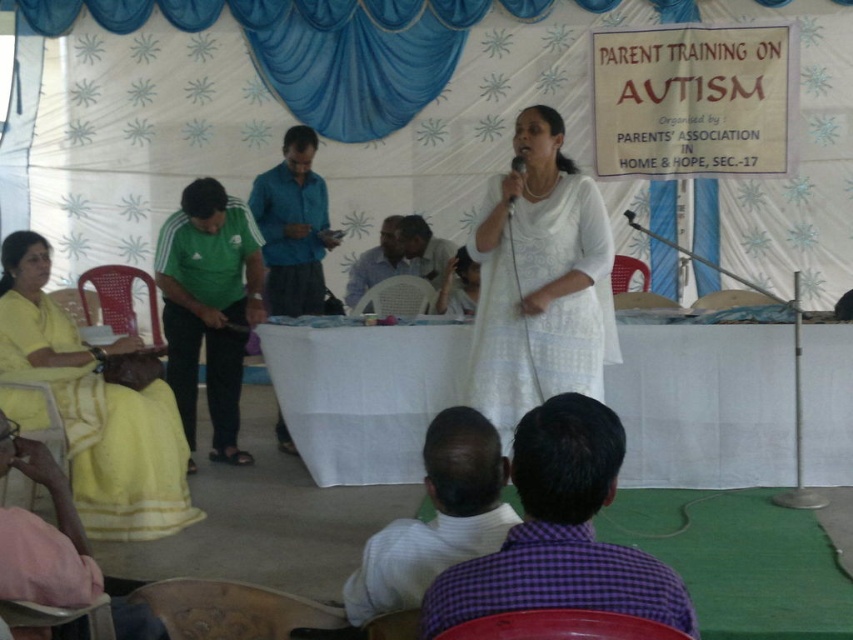
Is green adidas tracksuit at left smaller than blue fabric at center?

Incorrect, green adidas tracksuit at left is not smaller in size than blue fabric at center.

Can you confirm if green adidas tracksuit at left is positioned below blue fabric at center?

Yes.

Is point (181, 300) positioned behind point (323, 195)?

No, (181, 300) is closer to viewer.

The height and width of the screenshot is (640, 853). What are the coordinates of `green adidas tracksuit at left` in the screenshot? It's located at (209, 307).

Which of these two, white cloth table at center or white striped shirt at lower center, stands taller?

Standing taller between the two is white cloth table at center.

Between white cloth table at center and white striped shirt at lower center, which one appears on the right side from the viewer's perspective?

white cloth table at center is more to the right.

Between point (695, 396) and point (438, 426), which one is positioned in front?

Point (438, 426) is in front.

The width and height of the screenshot is (853, 640). I want to click on white cloth table at center, so click(705, 404).

Can you confirm if white cloth table at center is wider than white cotton dress at center?

Yes.

Can you confirm if white cloth table at center is positioned above white cotton dress at center?

No.

Is point (711, 451) less distant than point (546, 358)?

No, it is behind (546, 358).

Locate an element on the screen. The width and height of the screenshot is (853, 640). white cloth table at center is located at coordinates (705, 404).